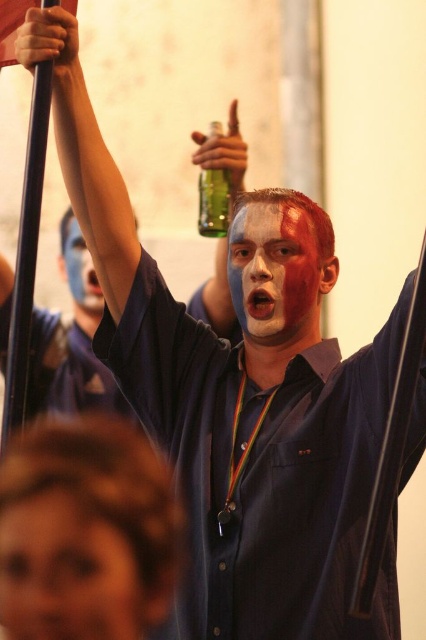
Based on the photo, you are standing at the origin point in the image and want to move towards the point labeled point (49, 595). Will you pass by the point labeled point (219, 192) first before reaching your destination?

Yes, because point (49, 595) is in front of point (219, 192), so you will pass by point (219, 192) first before reaching point (49, 595).